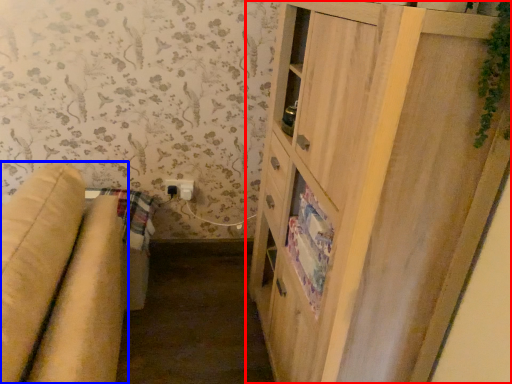
Question: Which object is further to the camera taking this photo, cupboard (highlighted by a red box) or studio couch (highlighted by a blue box)?

Choices:
 (A) cupboard
 (B) studio couch

Answer: (A)